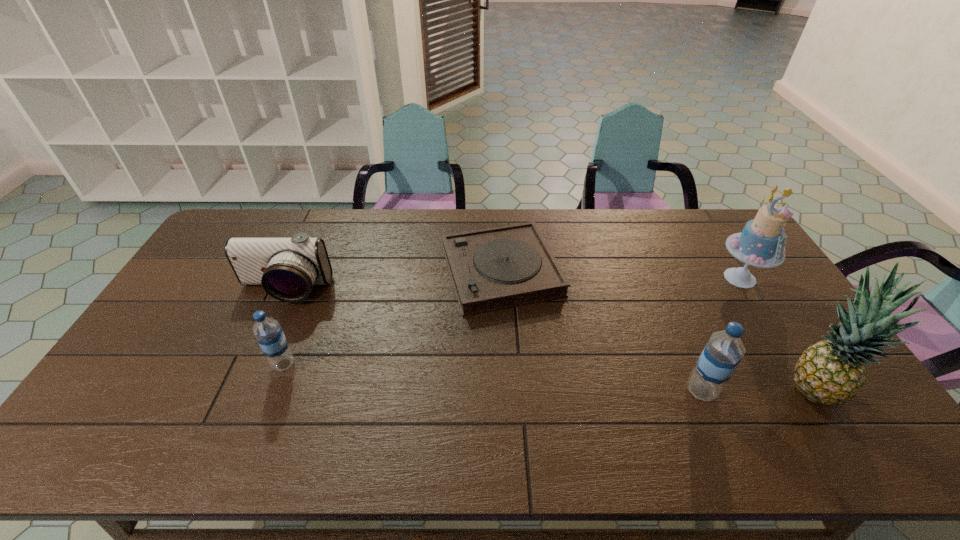
The width and height of the screenshot is (960, 540). I want to click on vacant area that lies between the shortest object and the camcorder, so click(393, 281).

Find the location of a particular element. unoccupied area between the pineapple and the nearer water bottle is located at coordinates (756, 390).

Locate an element on the screen. The image size is (960, 540). object that ranks as the closest to the farther water bottle is located at coordinates (287, 268).

Choose which object is the fifth nearest neighbor to the cake. Please provide its 2D coordinates. Your answer should be formatted as a tuple, i.e. [(x, y)], where the tuple contains the x and y coordinates of a point satisfying the conditions above.

[(268, 332)]

The width and height of the screenshot is (960, 540). I want to click on free space that satisfies the following two spatial constraints: 1. with a ladder on the side of the second tallest object; 2. on the label of the right water bottle, so click(811, 391).

Find the location of a particular element. Image resolution: width=960 pixels, height=540 pixels. free space that satisfies the following two spatial constraints: 1. on the front side of the shortest object; 2. on the label of the left water bottle is located at coordinates (506, 364).

This screenshot has width=960, height=540. Find the location of `vacant region that satisfies the following two spatial constraints: 1. on the label of the shorter water bottle; 2. on the right side of the pineapple`. vacant region that satisfies the following two spatial constraints: 1. on the label of the shorter water bottle; 2. on the right side of the pineapple is located at coordinates (274, 389).